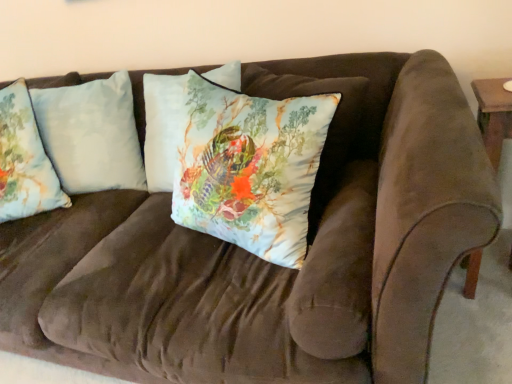
Question: Should I look upward or downward to see light blue fabric pillow at left, placed as the third pillow when sorted from right to left?

Choices:
 (A) up
 (B) down

Answer: (A)

Question: Is light blue fabric pillow at left, which appears as the second pillow when viewed from the left, behind silky floral pillow at center, positioned as the first pillow in right-to-left order?

Choices:
 (A) yes
 (B) no

Answer: (A)

Question: Does light blue fabric pillow at left, which ranks as the second pillow in right-to-left order, appear on the left side of silky floral pillow at center, positioned as the first pillow in right-to-left order?

Choices:
 (A) no
 (B) yes

Answer: (B)

Question: Does light blue fabric pillow at left, which appears as the second pillow when viewed from the left, come in front of silky floral pillow at center, positioned as the first pillow in right-to-left order?

Choices:
 (A) yes
 (B) no

Answer: (B)

Question: From a real-world perspective, does light blue fabric pillow at left, which appears as the second pillow when viewed from the left, stand above silky floral pillow at center, marked as the third pillow in a left-to-right arrangement?

Choices:
 (A) no
 (B) yes

Answer: (A)

Question: Considering the relative positions of light blue fabric pillow at left, which ranks as the second pillow in right-to-left order, and silky floral pillow at center, marked as the third pillow in a left-to-right arrangement, in the image provided, is light blue fabric pillow at left, which ranks as the second pillow in right-to-left order, to the right of silky floral pillow at center, marked as the third pillow in a left-to-right arrangement, from the viewer's perspective?

Choices:
 (A) yes
 (B) no

Answer: (B)

Question: Is light blue fabric pillow at left, which ranks as the second pillow in right-to-left order, shorter than silky floral pillow at center, marked as the third pillow in a left-to-right arrangement?

Choices:
 (A) no
 (B) yes

Answer: (A)

Question: Does light blue fabric pillow at left, which appears as the second pillow when viewed from the left, appear on the right side of light blue fabric pillow at left, the first pillow from the left?

Choices:
 (A) yes
 (B) no

Answer: (A)

Question: Is the depth of light blue fabric pillow at left, which ranks as the second pillow in right-to-left order, greater than that of light blue fabric pillow at left, the first pillow from the left?

Choices:
 (A) yes
 (B) no

Answer: (A)

Question: Are light blue fabric pillow at left, which ranks as the second pillow in right-to-left order, and light blue fabric pillow at left, the first pillow from the left, beside each other?

Choices:
 (A) no
 (B) yes

Answer: (A)

Question: Considering the relative positions of light blue fabric pillow at left, which appears as the second pillow when viewed from the left, and light blue fabric pillow at left, placed as the third pillow when sorted from right to left, in the image provided, is light blue fabric pillow at left, which appears as the second pillow when viewed from the left, to the left of light blue fabric pillow at left, placed as the third pillow when sorted from right to left, from the viewer's perspective?

Choices:
 (A) yes
 (B) no

Answer: (B)

Question: Is light blue fabric pillow at left, placed as the third pillow when sorted from right to left, inside light blue fabric pillow at left, which appears as the second pillow when viewed from the left?

Choices:
 (A) no
 (B) yes

Answer: (B)

Question: Is light blue fabric pillow at left, which appears as the second pillow when viewed from the left, wider than light blue fabric pillow at left, placed as the third pillow when sorted from right to left?

Choices:
 (A) no
 (B) yes

Answer: (B)

Question: Is silky floral pillow at center, positioned as the first pillow in right-to-left order, positioned behind light blue fabric pillow at left, placed as the third pillow when sorted from right to left?

Choices:
 (A) yes
 (B) no

Answer: (B)